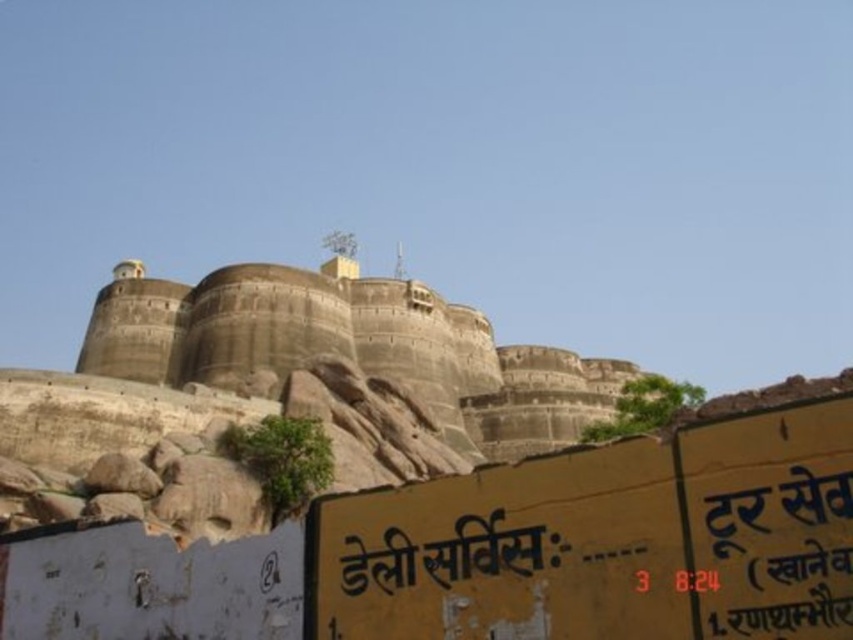
How far apart are gray stone castle at center and black painted signboard at lower center?

They are 224.06 feet apart.

Who is more forward, (170,490) or (445,552)?

Point (445,552)

The image size is (853, 640). I want to click on gray stone castle at center, so click(x=277, y=396).